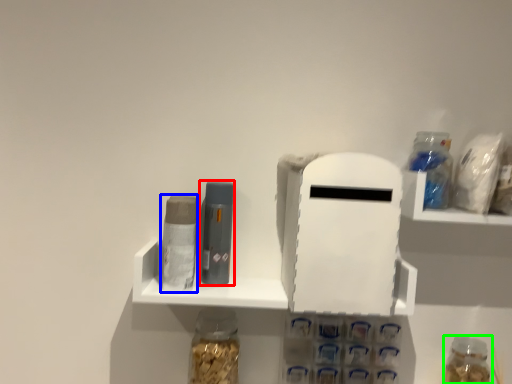
Question: Considering the real-world distances, which object is farthest from toiletry (highlighted by a red box)? toiletry (highlighted by a blue box) or bottle (highlighted by a green box)?

Choices:
 (A) toiletry
 (B) bottle

Answer: (B)